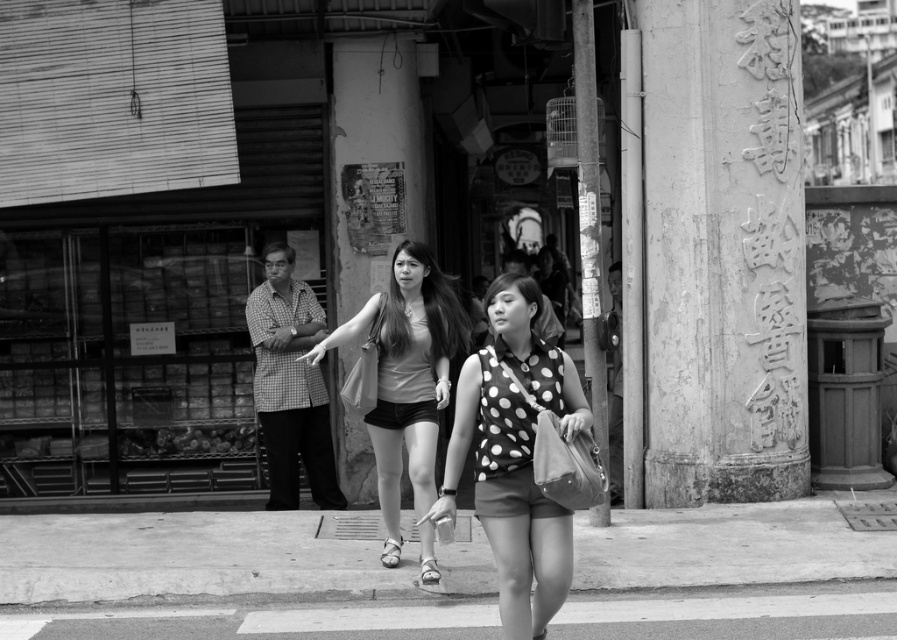
Describe the element at coordinates (373, 163) in the screenshot. I see `smooth concrete pillar at center` at that location.

Does smooth concrete pillar at center have a smaller size compared to smooth stone pillar at right?

Actually, smooth concrete pillar at center might be larger than smooth stone pillar at right.

Find the location of a particular element. The height and width of the screenshot is (640, 897). smooth concrete pillar at center is located at coordinates (373, 163).

Can you confirm if weathered stone pillar at right is shorter than polka dot fabric top at center?

No, weathered stone pillar at right is not shorter than polka dot fabric top at center.

Who is more distant from viewer, (675, 253) or (562, 520)?

The point (675, 253) is behind.

At what (x,y) coordinates should I click in order to perform the action: click on weathered stone pillar at right. Please return your answer as a coordinate pair (x, y). Image resolution: width=897 pixels, height=640 pixels. Looking at the image, I should click on (723, 252).

Does polka dot fabric top at center have a smaller size compared to smooth stone pillar at right?

No.

Does point (508, 385) come closer to viewer compared to point (576, 132)?

Yes, it is in front of point (576, 132).

Which is in front, point (519, 483) or point (591, 384)?

Point (519, 483) is in front.

I want to click on polka dot fabric top at center, so click(x=515, y=456).